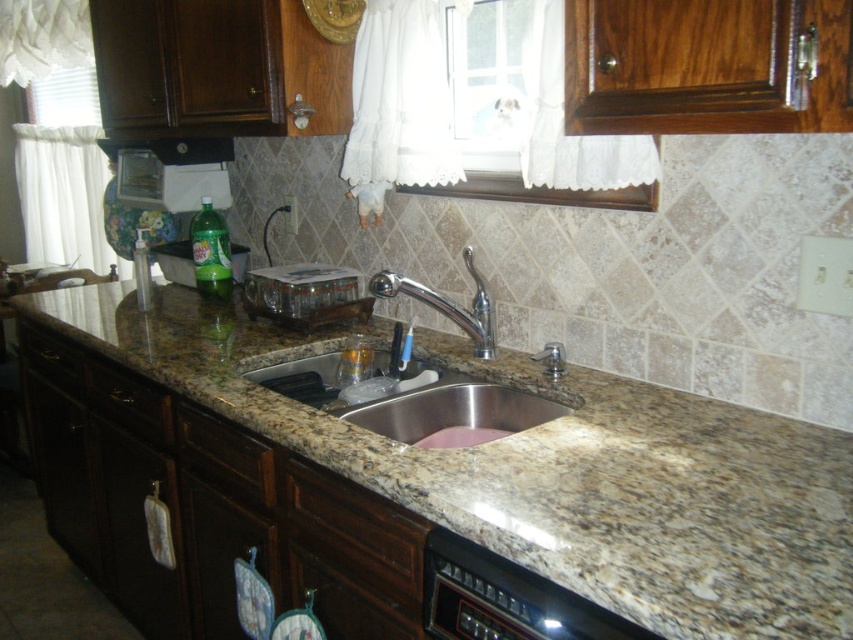
Question: Can you confirm if polished chrome faucet at center is positioned above black matte exhaust hood at upper center?

Choices:
 (A) no
 (B) yes

Answer: (A)

Question: Can you confirm if granite at center is thinner than black plastic dishwasher at lower center?

Choices:
 (A) yes
 (B) no

Answer: (B)

Question: Estimate the real-world distances between objects in this image. Which object is closer to the green plastic bottle at center?

Choices:
 (A) black plastic dishwasher at lower center
 (B) polished chrome faucet at center

Answer: (B)

Question: Which object appears closest to the camera in this image?

Choices:
 (A) green plastic bottle at center
 (B) black plastic dishwasher at lower center

Answer: (B)

Question: Can you confirm if stainless steel sink at center is positioned to the right of black matte exhaust hood at upper center?

Choices:
 (A) no
 (B) yes

Answer: (B)

Question: Which point is closer to the camera taking this photo?

Choices:
 (A) (323, 547)
 (B) (200, 259)

Answer: (A)